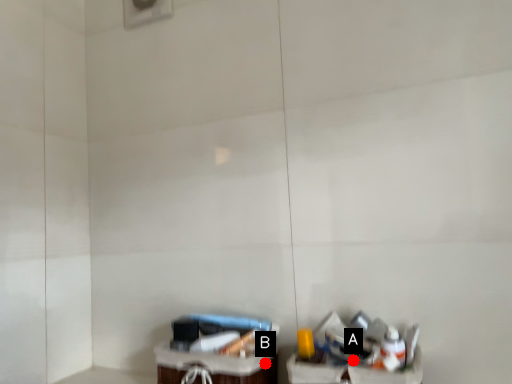
Question: Two points are circled on the image, labeled by A and B beside each circle. Which of the following is the closest to the observer?

Choices:
 (A) A is closer
 (B) B is closer

Answer: (A)